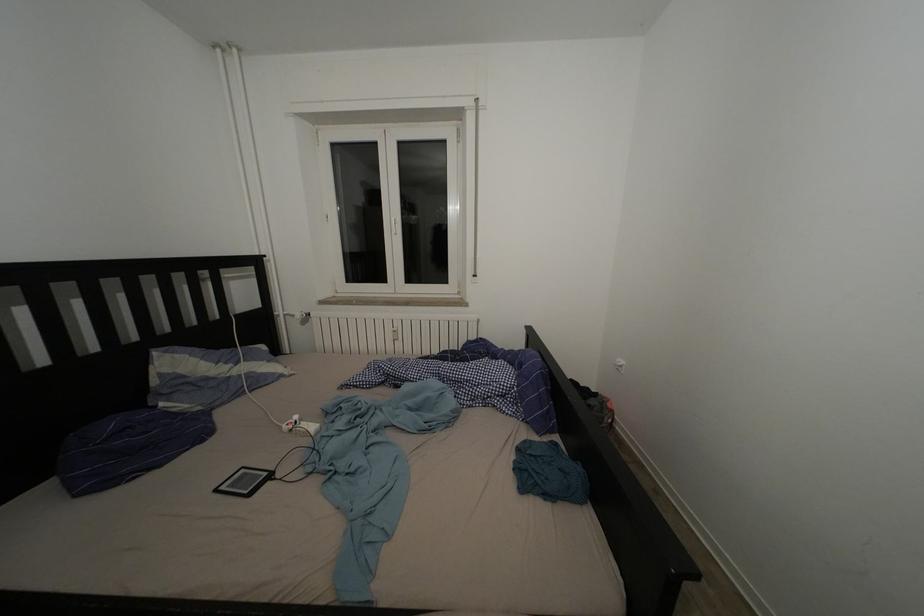
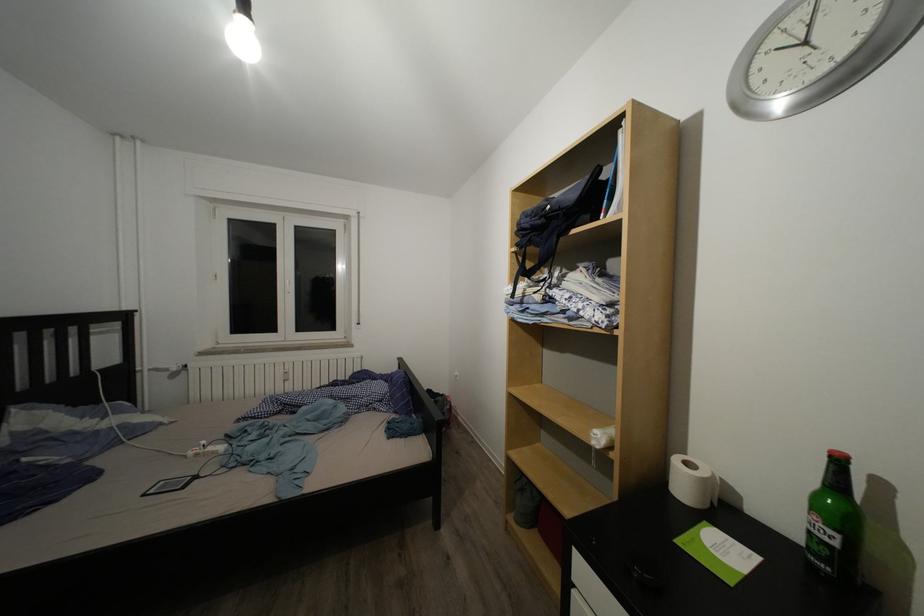
Question: How did the camera likely rotate?

Choices:
 (A) Left
 (B) Right
 (C) Up
 (D) Down

Answer: (B)